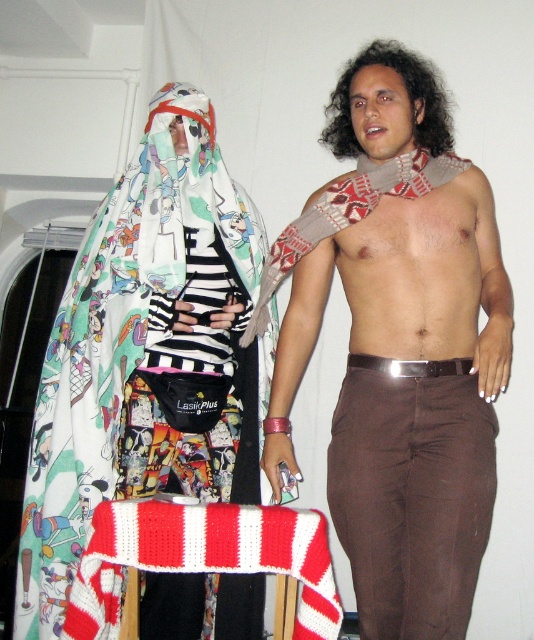
Is brown cotton pants at center shorter than skinny brown muscle at center?

No, brown cotton pants at center is not shorter than skinny brown muscle at center.

Describe the element at coordinates (405, 397) in the screenshot. I see `brown cotton pants at center` at that location.

Locate an element on the screen. brown cotton pants at center is located at coordinates (405, 397).

Is point (388, 273) farther from camera compared to point (282, 552)?

That is True.

Between skinny brown muscle at center and knitted red and white scarf at center, which one has more height?

skinny brown muscle at center is taller.

This screenshot has width=534, height=640. Identify the location of skinny brown muscle at center. (418, 272).

Does knitted red and white scarf at left have a greater width compared to knitted red and white scarf at center?

Yes, knitted red and white scarf at left is wider than knitted red and white scarf at center.

Can you confirm if knitted red and white scarf at left is taller than knitted red and white scarf at center?

Yes, knitted red and white scarf at left is taller than knitted red and white scarf at center.

At what (x,y) coordinates should I click in order to perform the action: click on knitted red and white scarf at left. Please return your answer as a coordinate pair (x, y). This screenshot has height=640, width=534. Looking at the image, I should click on (145, 352).